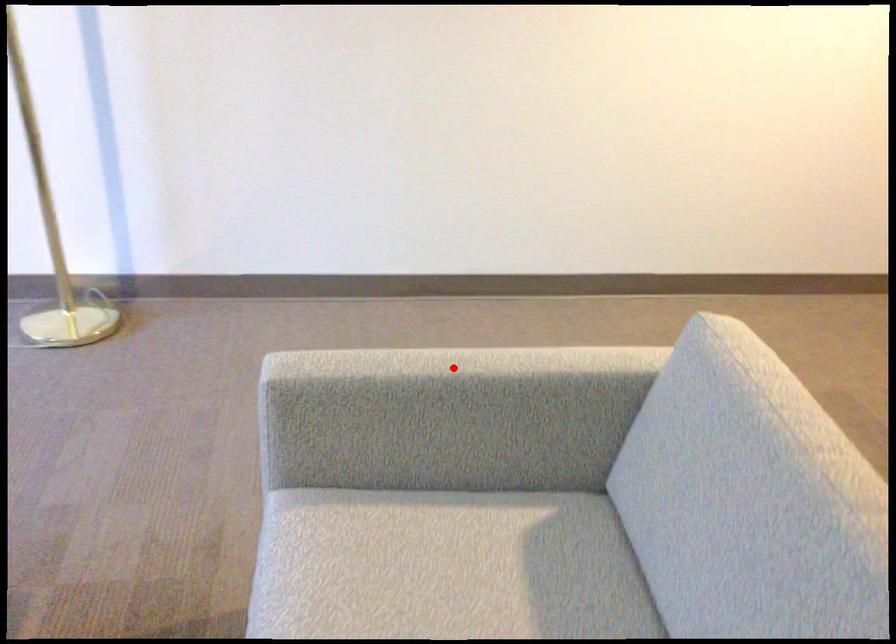
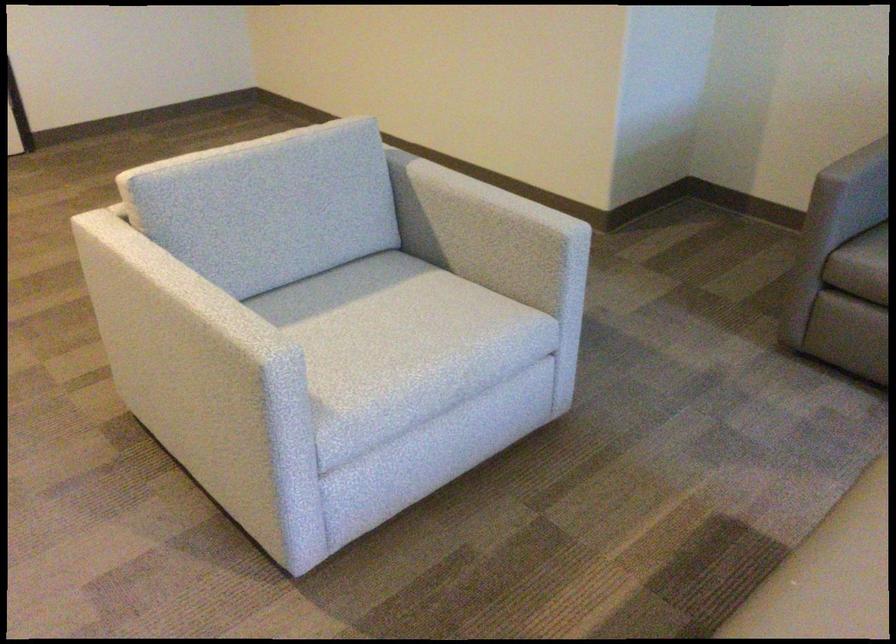
Find the pixel in the second image that matches the highlighted location in the first image.

(195, 294)